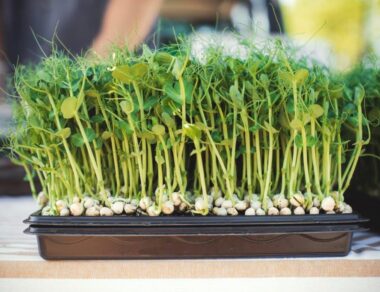
Locate an element on the screen. The height and width of the screenshot is (292, 380). black tray lip is located at coordinates (165, 218).